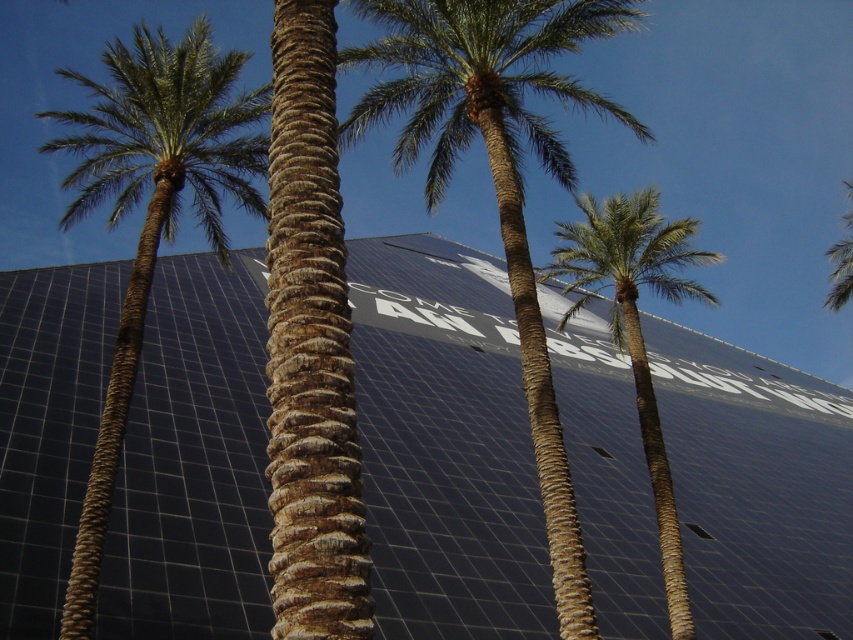
Question: Based on their relative distances, which object is nearer to the green leafy palm tree at left?

Choices:
 (A) green leafy palm tree at center
 (B) black glass building at center
 (C) green leafy palm at center

Answer: (B)

Question: Does green leafy palm tree at center come behind green leafy palm at center?

Choices:
 (A) yes
 (B) no

Answer: (B)

Question: Does black glass building at center appear under green leafy palm tree at center?

Choices:
 (A) yes
 (B) no

Answer: (A)

Question: Which of the following is the closest to the observer?

Choices:
 (A) (100, 180)
 (B) (213, 456)

Answer: (A)

Question: Estimate the real-world distances between objects in this image. Which object is farther from the green leafy palm tree at center?

Choices:
 (A) green leafy palm at center
 (B) black glass building at center
 (C) green leafy palm tree at left

Answer: (C)

Question: Can you confirm if black glass building at center is positioned to the right of green leafy palm at center?

Choices:
 (A) no
 (B) yes

Answer: (A)